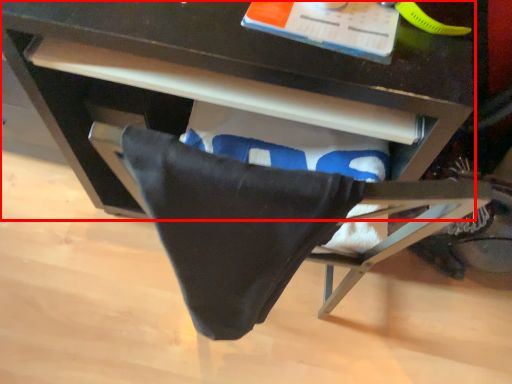
Question: From the image's perspective, where is desk (annotated by the red box) located in relation to blanket in the image?

Choices:
 (A) above
 (B) below

Answer: (A)